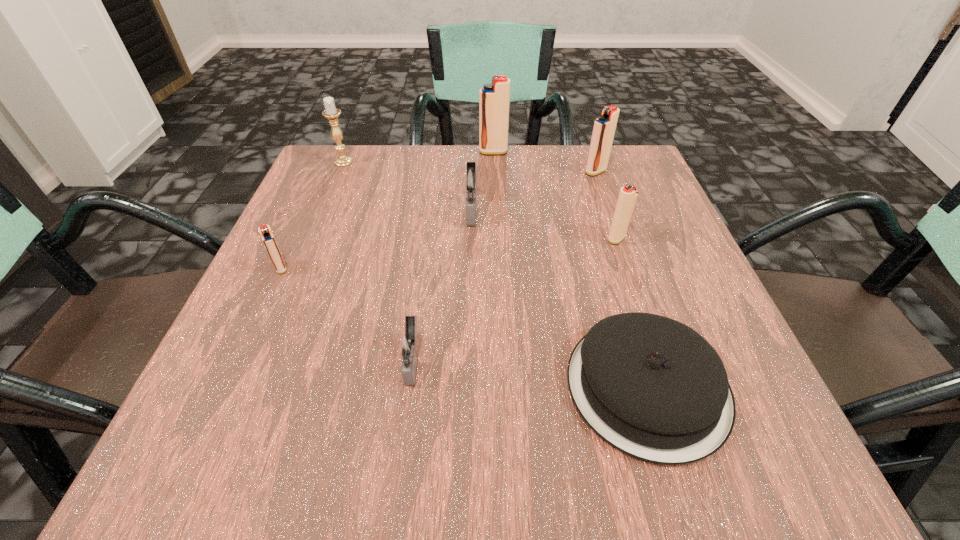
Where is `the farthest object`? the farthest object is located at coordinates (494, 99).

I want to click on the third red igniter from right to left, so click(x=494, y=99).

At what (x,y) coordinates should I click in order to perform the action: click on candle holder. Please return your answer as a coordinate pair (x, y). Image resolution: width=960 pixels, height=540 pixels. Looking at the image, I should click on (331, 112).

Identify the location of the second farthest igniter. (604, 127).

Identify the location of the fifth shortest igniter. The width and height of the screenshot is (960, 540). (604, 127).

I want to click on the farther gray igniter, so click(x=471, y=180).

The height and width of the screenshot is (540, 960). I want to click on the fourth farthest object, so click(x=471, y=180).

This screenshot has height=540, width=960. I want to click on the fifth farthest object, so click(x=628, y=194).

At what (x,y) coordinates should I click in order to perform the action: click on the third biggest red igniter. Please return your answer as a coordinate pair (x, y). The width and height of the screenshot is (960, 540). Looking at the image, I should click on (628, 194).

The height and width of the screenshot is (540, 960). I want to click on the smallest red igniter, so point(267,236).